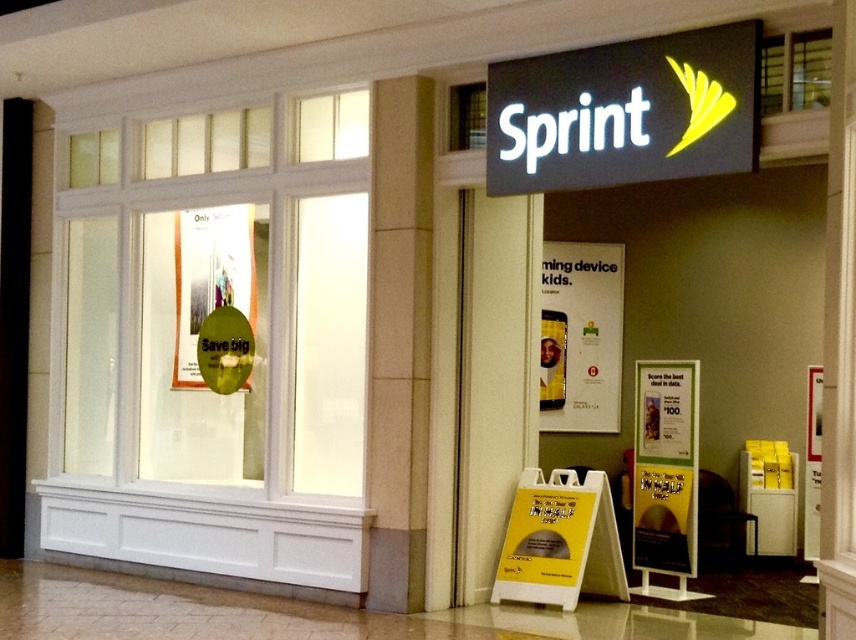
Between black matte sign at upper center and green glossy sign at upper left, which one appears on the left side from the viewer's perspective?

green glossy sign at upper left is more to the left.

Can you confirm if black matte sign at upper center is shorter than green glossy sign at upper left?

Yes.

Locate an element on the screen. The image size is (856, 640). black matte sign at upper center is located at coordinates (625, 112).

Identify the location of black matte sign at upper center. (625, 112).

Who is positioned more to the left, white paper sign at center or green glossy sign at upper left?

Positioned to the left is green glossy sign at upper left.

Who is higher up, white paper sign at center or green glossy sign at upper left?

green glossy sign at upper left is higher up.

Image resolution: width=856 pixels, height=640 pixels. Identify the location of white paper sign at center. (581, 337).

Does black matte sign at upper center appear over white paper sign at center?

Yes.

What do you see at coordinates (625, 112) in the screenshot? I see `black matte sign at upper center` at bounding box center [625, 112].

Identify the location of black matte sign at upper center. The width and height of the screenshot is (856, 640). (625, 112).

Image resolution: width=856 pixels, height=640 pixels. Identify the location of black matte sign at upper center. (625, 112).